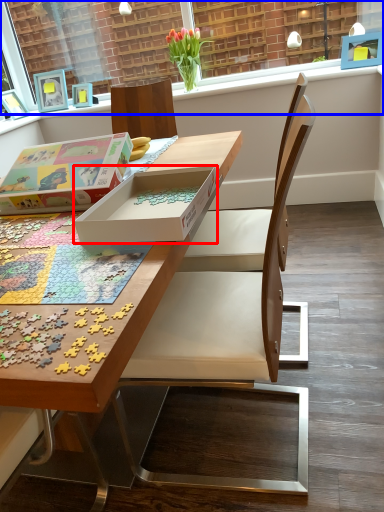
Question: Which of the following is the closest to the observer, box (highlighted by a red box) or window frame (highlighted by a blue box)?

Choices:
 (A) box
 (B) window frame

Answer: (A)